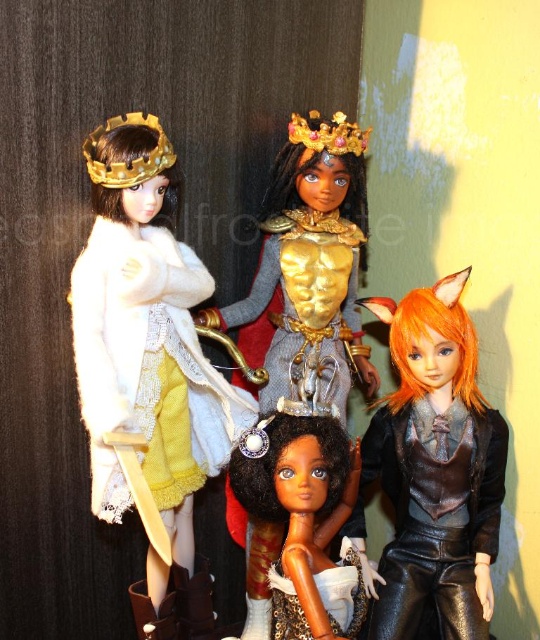
Question: Which point is closer to the camera?

Choices:
 (A) gold woven crown at upper left
 (B) gold metallic crown at upper center
 (C) shiny gold crown at center
 (D) matte white coat at upper left

Answer: (C)

Question: Does white fuzzy coat at left have a greater width compared to gold woven crown at upper left?

Choices:
 (A) no
 (B) yes

Answer: (B)

Question: Where is matte white coat at upper left located in relation to gold metallic crown at center in the image?

Choices:
 (A) left
 (B) right

Answer: (A)

Question: Which point appears farthest from the camera in this image?

Choices:
 (A) (356, 125)
 (B) (286, 448)
 (C) (381, 620)

Answer: (A)

Question: Does matte white coat at upper left have a smaller size compared to gold woven crown at upper left?

Choices:
 (A) no
 (B) yes

Answer: (A)

Question: Which object appears farthest from the camera in this image?

Choices:
 (A) gold woven crown at upper left
 (B) gold metallic crown at upper center
 (C) white fuzzy coat at left

Answer: (B)